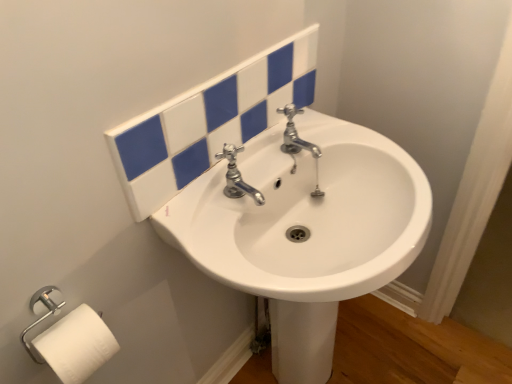
Where is `vacant area that lies in front of polished chrome faucet at center`? Image resolution: width=512 pixels, height=384 pixels. vacant area that lies in front of polished chrome faucet at center is located at coordinates (237, 256).